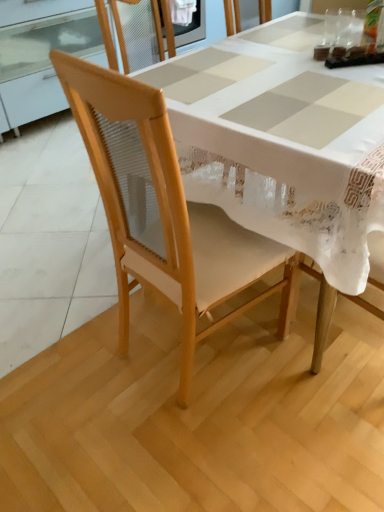
Image resolution: width=384 pixels, height=512 pixels. Find the location of `vacant area that is in front of transparent glass at upper center, which ranks as the second tableware in left-to-right order`. vacant area that is in front of transparent glass at upper center, which ranks as the second tableware in left-to-right order is located at coordinates (348, 42).